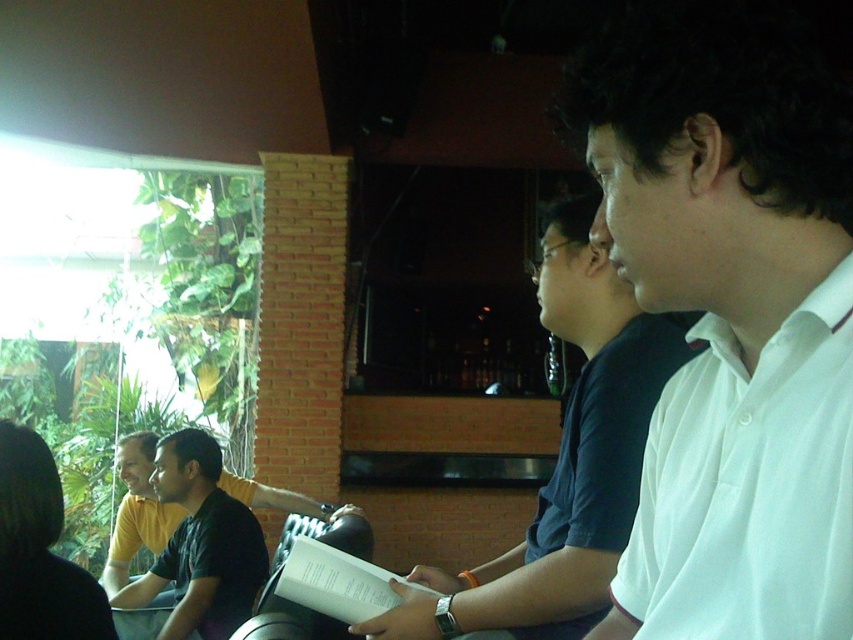
Between white smooth shirt at center and white cotton shirt at right, which one is positioned lower?

Positioned lower is white cotton shirt at right.

Is white smooth shirt at center bigger than white cotton shirt at right?

No, white smooth shirt at center is not bigger than white cotton shirt at right.

Locate an element on the screen. The width and height of the screenshot is (853, 640). white smooth shirt at center is located at coordinates (730, 316).

The height and width of the screenshot is (640, 853). I want to click on white smooth shirt at center, so click(730, 316).

Is point (822, 202) more distant than point (254, 541)?

That is False.

Can you confirm if white smooth shirt at center is thinner than dark green shirt at center?

Yes, white smooth shirt at center is thinner than dark green shirt at center.

You are a GUI agent. You are given a task and a screenshot of the screen. Output one action in this format:
    pyautogui.click(x=<x>, y=<y>)
    Task: Click on the white smooth shirt at center
    
    Given the screenshot: What is the action you would take?
    click(x=730, y=316)

Who is higher up, white cotton shirt at right or dark green shirt at center?

white cotton shirt at right is above.

Can you confirm if white cotton shirt at right is positioned above dark green shirt at center?

Yes.

Does point (404, 611) come behind point (224, 612)?

No.

Image resolution: width=853 pixels, height=640 pixels. Identify the location of white cotton shirt at right. (566, 460).